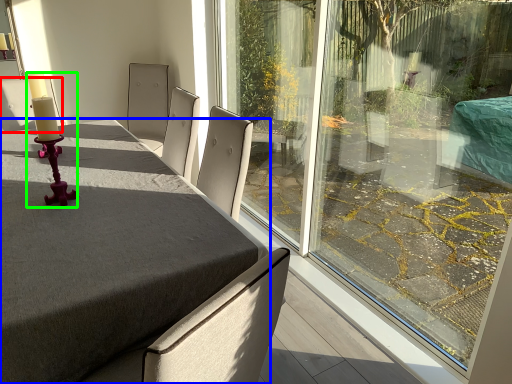
Question: Which object is the farthest from chair (highlighted by a red box)? Choose among these: table (highlighted by a blue box) or candle holder (highlighted by a green box).

Choices:
 (A) table
 (B) candle holder

Answer: (A)